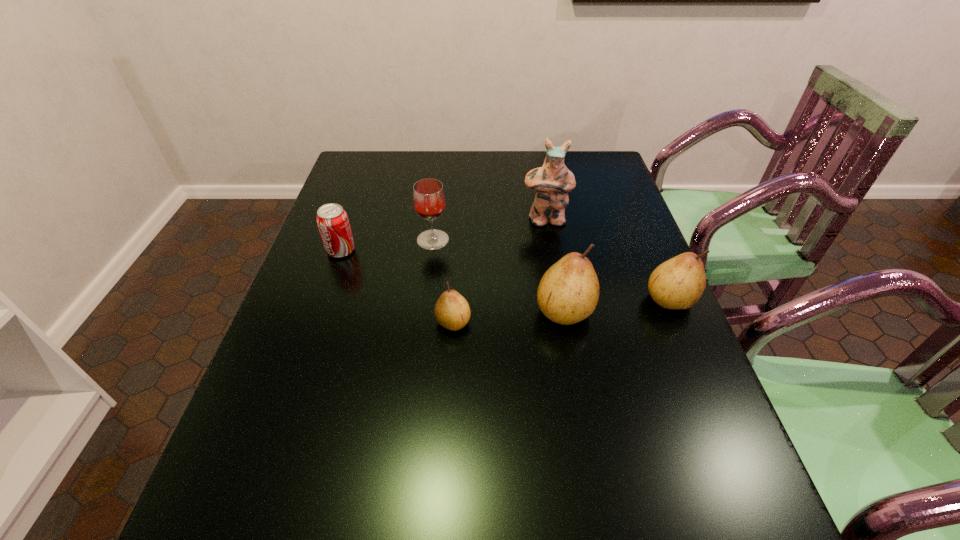
Where is `free region at the left edge of the desktop`? Image resolution: width=960 pixels, height=540 pixels. free region at the left edge of the desktop is located at coordinates point(308,271).

Locate an element on the screen. free space at the right edge of the desktop is located at coordinates (637, 328).

In the image, there is a desktop. Find the location of `vacant area at the far left corner`. vacant area at the far left corner is located at coordinates (379, 176).

I want to click on vacant space at the far right corner of the desktop, so click(x=579, y=166).

The width and height of the screenshot is (960, 540). I want to click on vacant space in between the leftmost object and the rightmost object, so click(x=506, y=275).

This screenshot has height=540, width=960. Find the location of `free space between the second shortest object and the rightmost pear`. free space between the second shortest object and the rightmost pear is located at coordinates (506, 275).

What are the coordinates of `free area in between the wineglass and the second shortest object` in the screenshot? It's located at (387, 245).

Locate an element on the screen. free area in between the shortest pear and the fifth tallest object is located at coordinates (397, 286).

I want to click on unoccupied position between the second shortest object and the leftmost pear, so click(x=397, y=286).

Image resolution: width=960 pixels, height=540 pixels. In order to click on vacant space that is in between the wineglass and the second pear from left to right in this screenshot , I will do `click(498, 275)`.